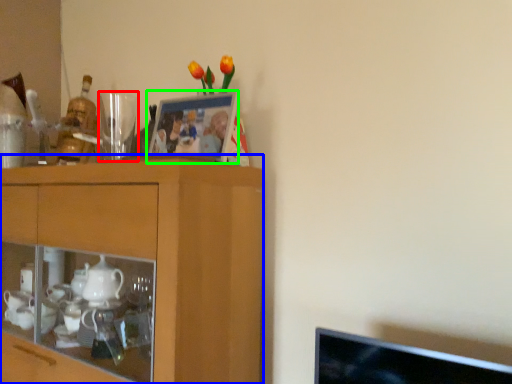
Question: Which object is the farthest from tableware (highlighted by a red box)? Choose among these: cabinetry (highlighted by a blue box) or picture frame (highlighted by a green box).

Choices:
 (A) cabinetry
 (B) picture frame

Answer: (A)